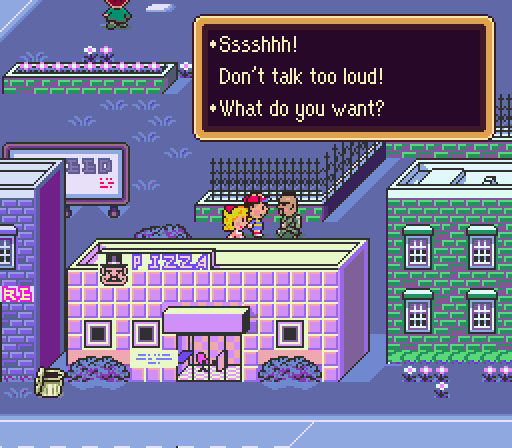
The image size is (512, 448). In order to click on window in this screenshot , I will do `click(293, 334)`.